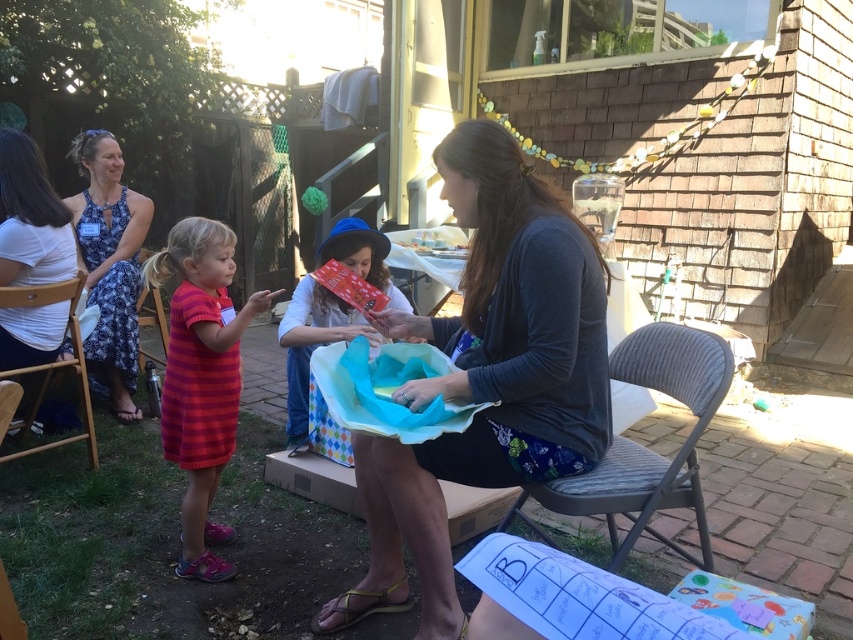
Which is more to the right, blue floral dress at left or white cotton shirt at left?

Positioned to the right is white cotton shirt at left.

Find the location of a particular element. blue floral dress at left is located at coordinates (109, 266).

Locate an element on the screen. Image resolution: width=853 pixels, height=640 pixels. blue floral dress at left is located at coordinates (109, 266).

Can you confirm if gray corduroy chair at center is positioned above wooden folding chair at left?

No, gray corduroy chair at center is not above wooden folding chair at left.

Measure the distance between gray corduroy chair at center and wooden folding chair at left.

The distance of gray corduroy chair at center from wooden folding chair at left is 2.34 meters.

Who is more distant from viewer, (703, 557) or (26, 301)?

The point (26, 301) is behind.

Find the location of a particular element. Image resolution: width=853 pixels, height=640 pixels. gray corduroy chair at center is located at coordinates (643, 445).

Who is taller, matte red card at center or wooden chair at lower left?

Standing taller between the two is matte red card at center.

Is point (321, 340) positioned in front of point (141, 307)?

That is True.

I want to click on matte red card at center, so click(x=312, y=342).